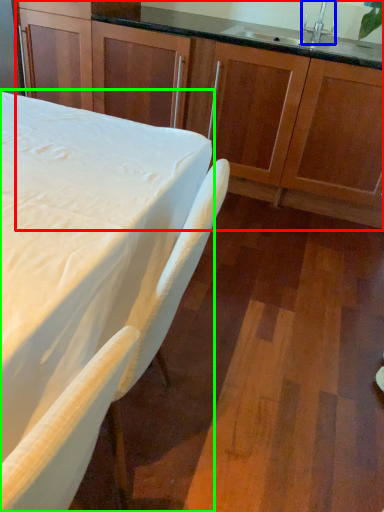
Question: Which object is positioned farthest from cabinetry (highlighted by a red box)? Select from faucet (highlighted by a blue box) and table (highlighted by a green box).

Choices:
 (A) faucet
 (B) table

Answer: (B)